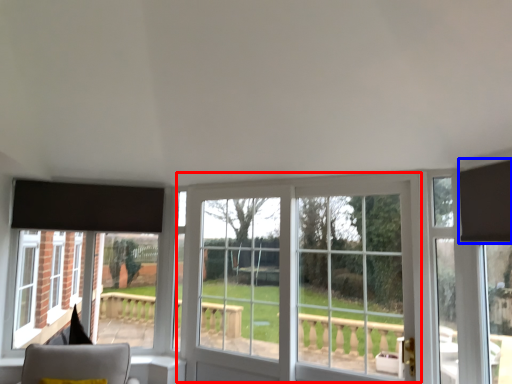
Question: Which object is closer to the camera taking this photo, window (highlighted by a red box) or curtain (highlighted by a blue box)?

Choices:
 (A) window
 (B) curtain

Answer: (B)